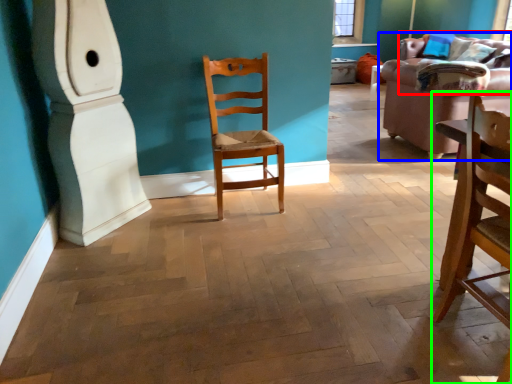
Question: Which is nearer to the couch (highlighted by a red box)? studio couch (highlighted by a blue box) or chair (highlighted by a green box).

Choices:
 (A) studio couch
 (B) chair

Answer: (A)